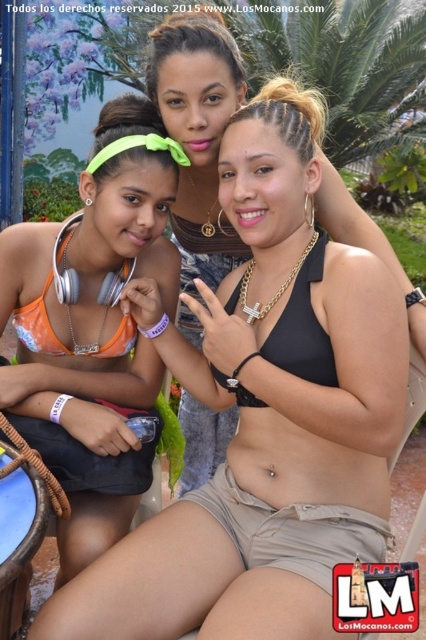
Which is behind, point (63, 566) or point (184, 209)?

The point (184, 209) is behind.

Is point (103, 250) positioned after point (212, 449)?

No, (103, 250) is closer to viewer.

The width and height of the screenshot is (426, 640). Identify the location of orange fabric bikini top at left. (94, 330).